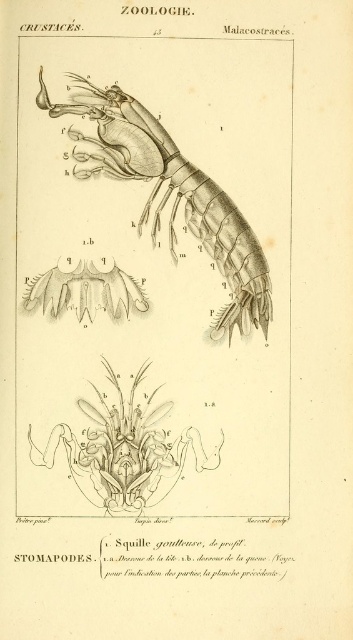
Consider the image. Can you confirm if translucent gray shrimp at center is bigger than grayish-white spines at center?

Correct, translucent gray shrimp at center is larger in size than grayish-white spines at center.

Can you confirm if translucent gray shrimp at center is thinner than grayish-white spines at center?

No.

Find the location of a particular element. Image resolution: width=353 pixels, height=640 pixels. translucent gray shrimp at center is located at coordinates (170, 193).

The image size is (353, 640). I want to click on translucent gray shrimp at center, so click(170, 193).

Based on the photo, who is more distant from viewer, (254, 298) or (156, 413)?

Positioned behind is point (254, 298).

Consider the image. Does translucent gray shrimp at center appear under translucent gray appendage at center?

Incorrect, translucent gray shrimp at center is not positioned below translucent gray appendage at center.

Which is behind, point (121, 109) or point (103, 417)?

The point (103, 417) is behind.

Image resolution: width=353 pixels, height=640 pixels. Find the location of `translucent gray shrimp at center`. translucent gray shrimp at center is located at coordinates tap(170, 193).

Based on the photo, between translucent gray appendage at center and grayish-white spines at center, which one has more height?

With more height is translucent gray appendage at center.

Who is more distant from viewer, (x=120, y=440) or (x=86, y=280)?

The point (x=86, y=280) is more distant.

The width and height of the screenshot is (353, 640). I want to click on translucent gray appendage at center, so click(124, 449).